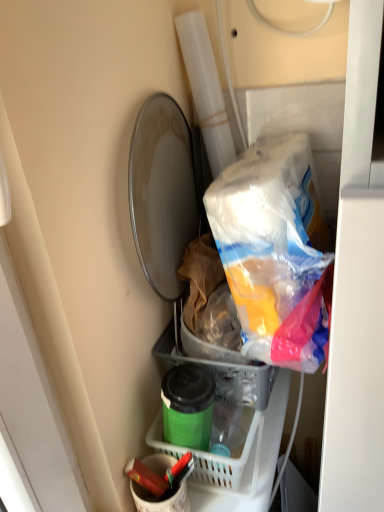
Question: Can you confirm if matte red crayon at lower center is taller than green plastic basket at lower center?

Choices:
 (A) yes
 (B) no

Answer: (A)

Question: Is matte red crayon at lower center further to the viewer compared to green plastic basket at lower center?

Choices:
 (A) no
 (B) yes

Answer: (A)

Question: Would you say matte red crayon at lower center is a long distance from green plastic basket at lower center?

Choices:
 (A) no
 (B) yes

Answer: (A)

Question: Is matte red crayon at lower center touching green plastic basket at lower center?

Choices:
 (A) no
 (B) yes

Answer: (B)

Question: Considering the relative positions of matte red crayon at lower center and green plastic basket at lower center in the image provided, is matte red crayon at lower center to the left of green plastic basket at lower center from the viewer's perspective?

Choices:
 (A) no
 (B) yes

Answer: (B)

Question: Could you tell me if matte red crayon at lower center is facing green plastic basket at lower center?

Choices:
 (A) no
 (B) yes

Answer: (A)

Question: From the image's perspective, does matte white bucket at lower center appear lower than green plastic basket at lower center?

Choices:
 (A) yes
 (B) no

Answer: (A)

Question: Is matte white bucket at lower center positioned far away from green plastic basket at lower center?

Choices:
 (A) no
 (B) yes

Answer: (A)

Question: Would you say green plastic basket at lower center is part of matte white bucket at lower center's contents?

Choices:
 (A) no
 (B) yes

Answer: (A)

Question: Can you confirm if matte white bucket at lower center is positioned to the right of green plastic basket at lower center?

Choices:
 (A) yes
 (B) no

Answer: (B)

Question: Considering the relative sizes of matte white bucket at lower center and green plastic basket at lower center in the image provided, is matte white bucket at lower center taller than green plastic basket at lower center?

Choices:
 (A) yes
 (B) no

Answer: (A)

Question: Considering the relative sizes of matte white bucket at lower center and green plastic basket at lower center in the image provided, is matte white bucket at lower center smaller than green plastic basket at lower center?

Choices:
 (A) no
 (B) yes

Answer: (B)

Question: Can you see matte red crayon at lower center touching matte white bucket at lower center?

Choices:
 (A) yes
 (B) no

Answer: (A)